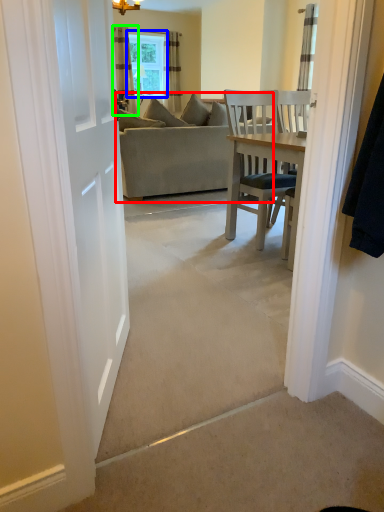
Question: Which object is the closest to the studio couch (highlighted by a red box)? Choose among these: window (highlighted by a blue box) or curtain (highlighted by a green box).

Choices:
 (A) window
 (B) curtain

Answer: (B)